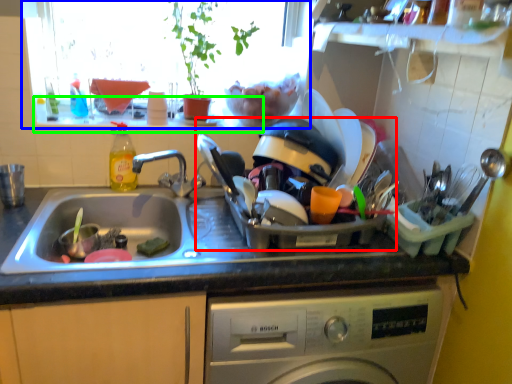
Question: Which is nearer to the appliance (highlighted by a red box)? window screen (highlighted by a blue box) or window sill (highlighted by a green box).

Choices:
 (A) window screen
 (B) window sill

Answer: (A)